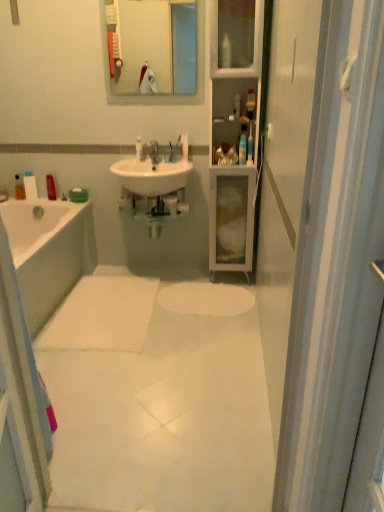
Find the location of `free space between white fabric shower curtain at left and white soft bath mat at center`. free space between white fabric shower curtain at left and white soft bath mat at center is located at coordinates (84, 386).